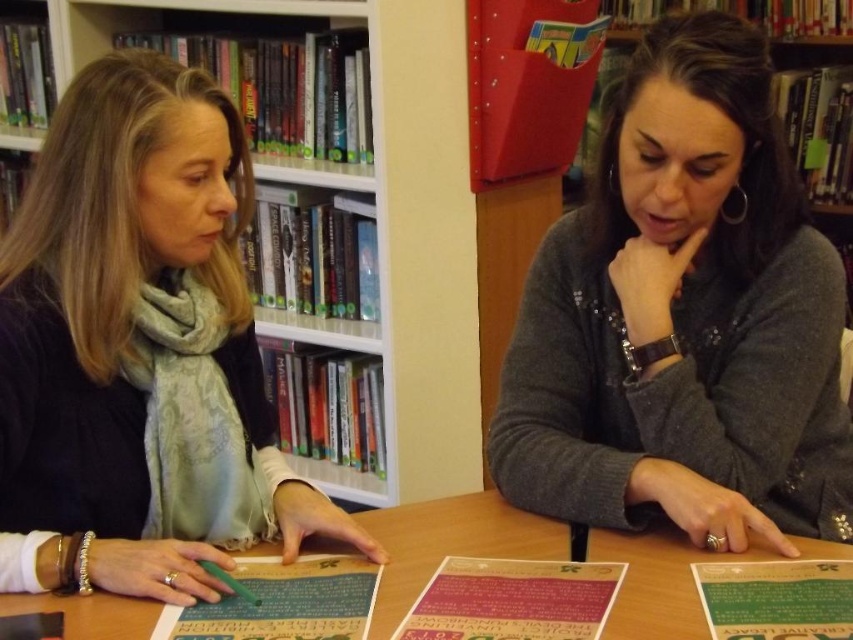
You are organizing a study session and need to place a large textbook on the table. Given that the matte black sweater at left is narrower than the smooth wooden table at center, will the sweater fit on the table without hanging over the edges?

The matte black sweater at left is narrower than the smooth wooden table at center, so it should fit on the table without hanging over the edges since its width is smaller than the table.

You are standing in the library and see the smooth wooden table at center and the green plastic pen at lower left. Which object is positioned to the left of the other?

The green plastic pen at lower left is positioned to the left of the smooth wooden table at center.

You are organizing a charity event and need to place a donation box on the smooth wooden table at center. The donation box is the same size as the matte black sweater at left. Will the donation box fit on the table?

The matte black sweater at left is larger in size than the smooth wooden table at center. Since the donation box is the same size as the sweater, it will not fit on the table.